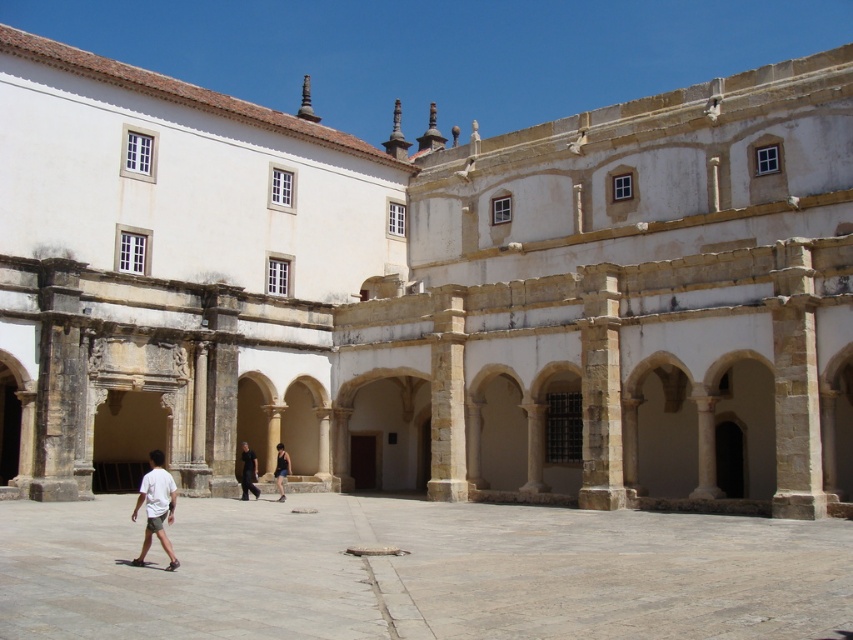
Question: Is white cotton shirt at lower left to the left of dark blue denim shorts at center from the viewer's perspective?

Choices:
 (A) no
 (B) yes

Answer: (B)

Question: Which object appears closest to the camera in this image?

Choices:
 (A) dark gray fabric pants at center
 (B) dark blue denim shorts at center
 (C) smooth stone courtyard at center

Answer: (C)

Question: Does white cotton shirt at lower left have a lesser width compared to dark blue denim shorts at center?

Choices:
 (A) yes
 (B) no

Answer: (B)

Question: Estimate the real-world distances between objects in this image. Which object is closer to the smooth stone courtyard at center?

Choices:
 (A) dark blue denim shorts at center
 (B) dark gray fabric pants at center
 (C) white cotton shirt at lower left

Answer: (C)

Question: Can you confirm if white cotton shirt at lower left is bigger than dark blue denim shorts at center?

Choices:
 (A) yes
 (B) no

Answer: (A)

Question: Which is nearer to the dark blue denim shorts at center?

Choices:
 (A) dark gray fabric pants at center
 (B) smooth stone courtyard at center

Answer: (A)